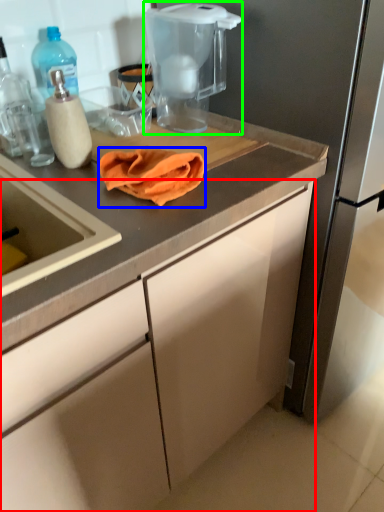
Question: Which is farther away from cabinetry (highlighted by a red box)? blanket (highlighted by a blue box) or home appliance (highlighted by a green box)?

Choices:
 (A) blanket
 (B) home appliance

Answer: (B)